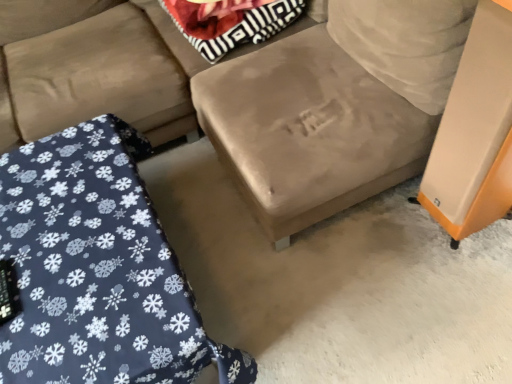
Identify the location of free space above blue fabric wrapping at lower left (from a real-world perspective). The width and height of the screenshot is (512, 384). (81, 249).